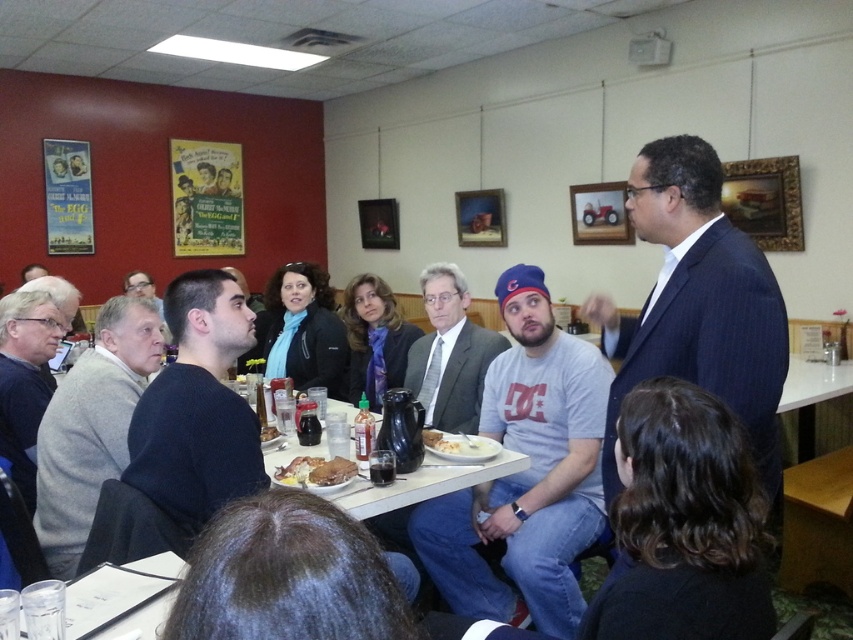
Is white bread at center below matte black jacket at upper center?

Yes.

Who is more distant from viewer, (448, 435) or (225, 182)?

Point (225, 182)

In order to click on white bread at center in this screenshot , I will do [x=450, y=444].

Is gray wool sweater at left below matte gray suit at center?

Yes, gray wool sweater at left is below matte gray suit at center.

Which is more to the left, gray wool sweater at left or matte gray suit at center?

gray wool sweater at left

Which is behind, point (61, 400) or point (450, 312)?

Positioned behind is point (450, 312).

Find the location of a particular element. gray wool sweater at left is located at coordinates (91, 426).

Between gray cotton t-shirt at center and dark blue sweater at center, which one is positioned higher?

Positioned higher is dark blue sweater at center.

Who is lower down, gray cotton t-shirt at center or dark blue sweater at center?

gray cotton t-shirt at center is lower down.

This screenshot has height=640, width=853. What are the coordinates of `gray cotton t-shirt at center` in the screenshot? It's located at (526, 474).

The image size is (853, 640). I want to click on gray cotton t-shirt at center, so click(526, 474).